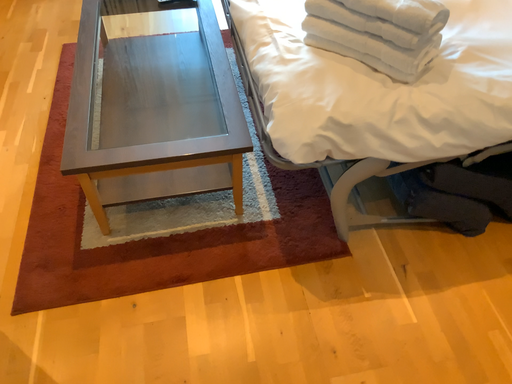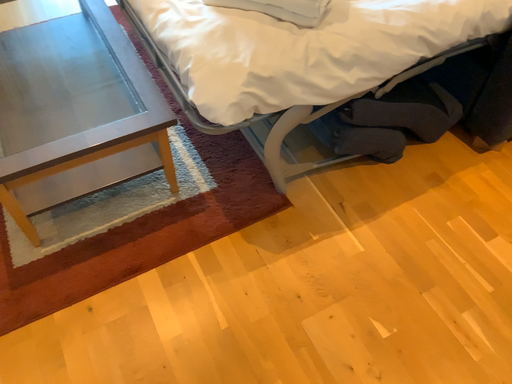
Question: How did the camera likely rotate when shooting the video?

Choices:
 (A) rotated right
 (B) rotated left

Answer: (A)